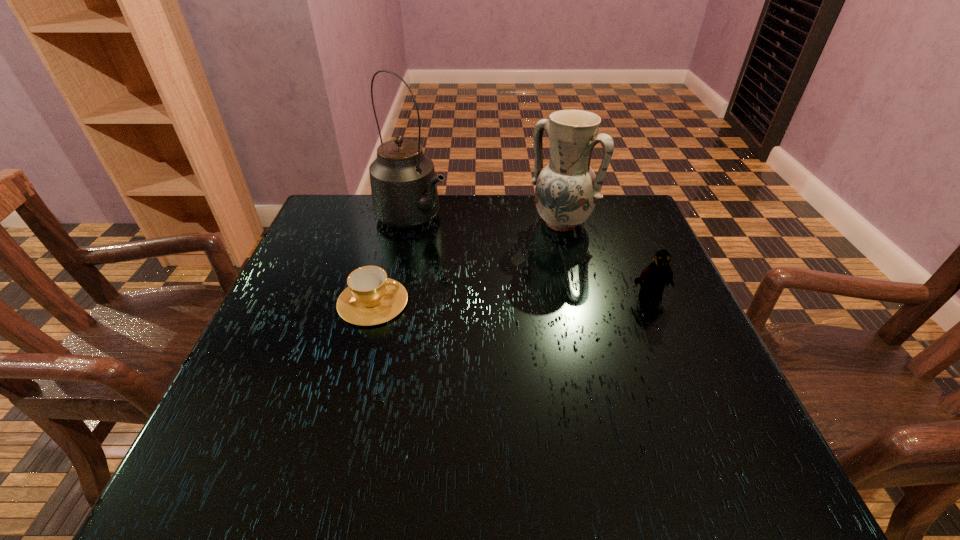
You are a GUI agent. You are given a task and a screenshot of the screen. Output one action in this format:
    pyautogui.click(x=<x>, y=<y>)
    Task: Click on the cup
    
    Given the screenshot: What is the action you would take?
    pyautogui.click(x=371, y=298)

What are the coordinates of `Lego` in the screenshot? It's located at (656, 275).

The height and width of the screenshot is (540, 960). I want to click on the second shortest object, so click(x=656, y=275).

The height and width of the screenshot is (540, 960). Find the location of `the third object from left to right`. the third object from left to right is located at coordinates (567, 189).

You are a GUI agent. You are given a task and a screenshot of the screen. Output one action in this format:
    pyautogui.click(x=<x>, y=<y>)
    Task: Click on the pottery
    The width and height of the screenshot is (960, 540).
    Given the screenshot: What is the action you would take?
    pyautogui.click(x=567, y=189)

I want to click on kettle, so click(x=404, y=191).

At what (x,y) coordinates should I click in order to perform the action: click on vacant space located 0.300m with the handle on the side of the shortest object. Please return your answer as a coordinate pair (x, y). This screenshot has height=540, width=960. Looking at the image, I should click on (545, 302).

The height and width of the screenshot is (540, 960). What are the coordinates of `free space located 0.300m on the face of the rightmost object` in the screenshot? It's located at (704, 427).

Where is `vacant area situated 0.300m on either side of the second tallest object`? vacant area situated 0.300m on either side of the second tallest object is located at coordinates (483, 305).

Identify the location of vacant space located 0.280m on either side of the second tallest object. (488, 300).